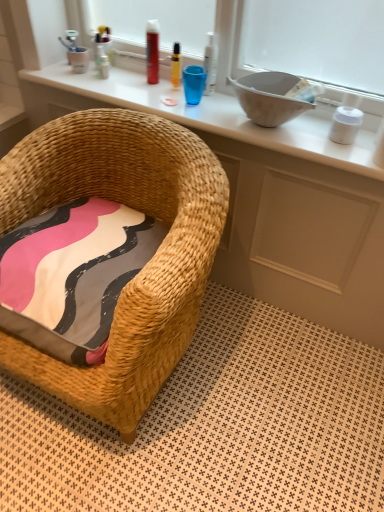
Where is `vacant region to the left of shiny red can at upper center, the second toiletry viewed from the left`? vacant region to the left of shiny red can at upper center, the second toiletry viewed from the left is located at coordinates (117, 79).